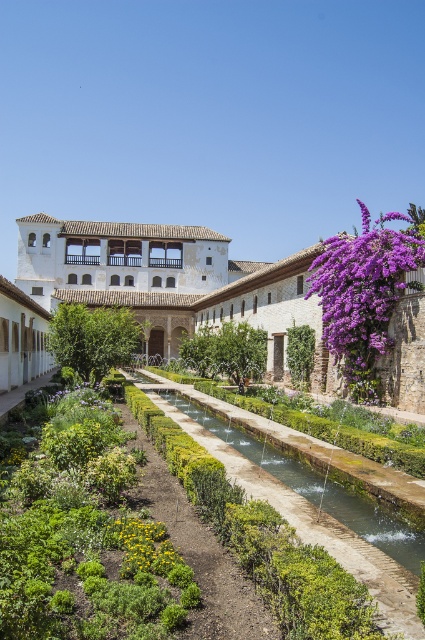
Where is `green mossy stone path at center`? The height and width of the screenshot is (640, 425). green mossy stone path at center is located at coordinates (319, 531).

Is green mossy stone path at center above yellow matte flower at center?

Actually, green mossy stone path at center is below yellow matte flower at center.

Does point (374, 596) come farther from viewer compared to point (130, 528)?

No, (374, 596) is in front of (130, 528).

The height and width of the screenshot is (640, 425). Find the location of `green mossy stone path at center`. green mossy stone path at center is located at coordinates (x=319, y=531).

Based on the photo, can you confirm if purple matte flowers at upper right is positioned to the right of green mossy stone path at center?

Indeed, purple matte flowers at upper right is positioned on the right side of green mossy stone path at center.

Is purple matte flowers at upper right to the left of green mossy stone path at center from the viewer's perspective?

In fact, purple matte flowers at upper right is to the right of green mossy stone path at center.

Is point (394, 294) positioned after point (397, 632)?

That is True.

Identify the location of purple matte flowers at upper right. point(365,292).

Which is in front, point (371, 378) or point (172, 564)?

Point (172, 564) is in front.

Between purple matte flowers at upper right and yellow matte flower at center, which one is positioned higher?

purple matte flowers at upper right is above.

You are a GUI agent. You are given a task and a screenshot of the screen. Output one action in this format:
    pyautogui.click(x=<x>, y=<y>)
    Task: Click on the purple matte flowers at upper right
    The width and height of the screenshot is (425, 640).
    Given the screenshot: What is the action you would take?
    pyautogui.click(x=365, y=292)